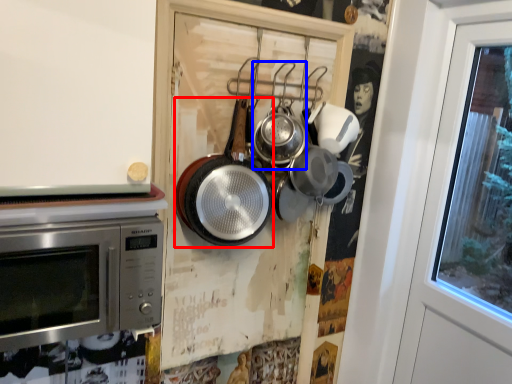
Question: Which of the following is the farthest to the observer, frying pan (highlighted by a red box) or frying pan (highlighted by a blue box)?

Choices:
 (A) frying pan
 (B) frying pan

Answer: (B)